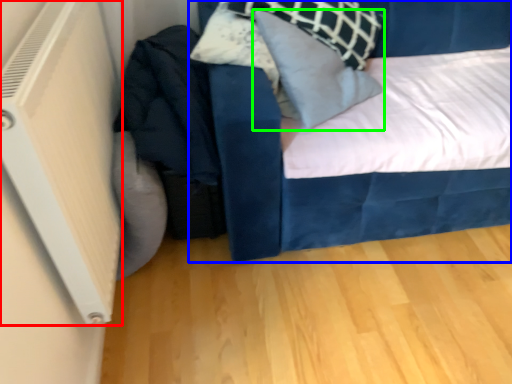
Question: Which is farther away from air conditioning (highlighted by a red box)? bed (highlighted by a blue box) or pillow (highlighted by a green box)?

Choices:
 (A) bed
 (B) pillow

Answer: (B)